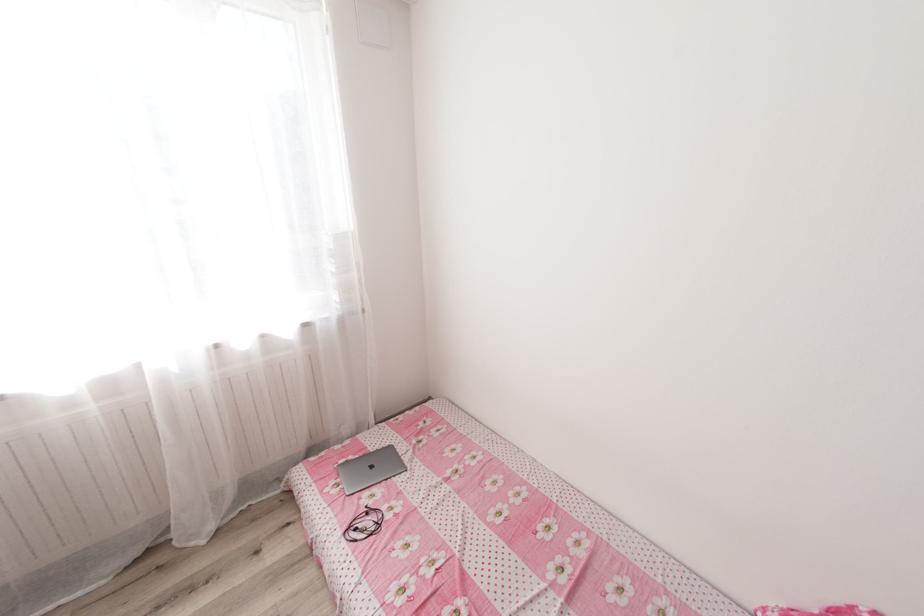
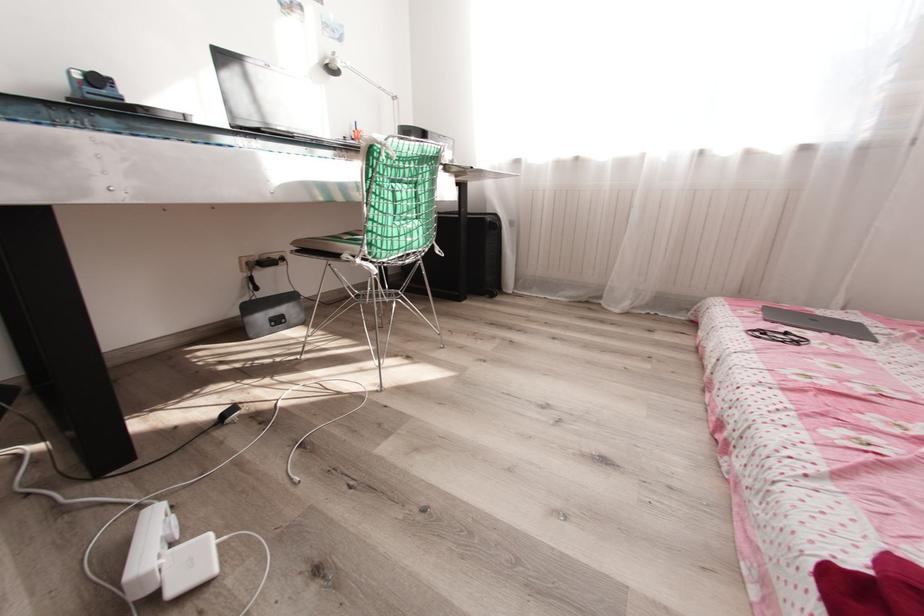
Question: The first image is from the beginning of the video and the second image is from the end. How did the camera likely rotate when shooting the video?

Choices:
 (A) Left
 (B) Right
 (C) Up
 (D) Down

Answer: (A)